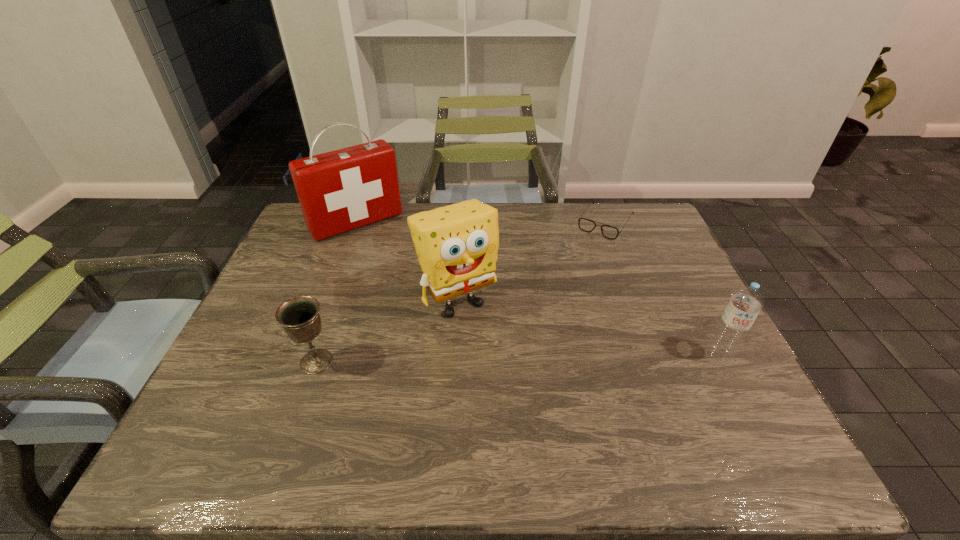
Where is `free space between the third object from left to right and the chalice`? The image size is (960, 540). free space between the third object from left to right and the chalice is located at coordinates (387, 330).

At what (x,y) coordinates should I click in order to perform the action: click on vacant area that lies between the tallest object and the rightmost object. Please return your answer as a coordinate pair (x, y). This screenshot has height=540, width=960. Looking at the image, I should click on (538, 289).

You are a GUI agent. You are given a task and a screenshot of the screen. Output one action in this format:
    pyautogui.click(x=<x>, y=<y>)
    Task: Click on the free space between the first-aid kit and the fourth tallest object
    Image resolution: width=960 pixels, height=540 pixels.
    Given the screenshot: What is the action you would take?
    pyautogui.click(x=337, y=292)

What are the coordinates of `empty space between the third tallest object and the shortest object` in the screenshot? It's located at (661, 289).

At what (x,y) coordinates should I click in order to perform the action: click on free space between the second tallest object and the sunglasses. Please return your answer as a coordinate pair (x, y). Looking at the image, I should click on (531, 261).

At what (x,y) coordinates should I click in order to perform the action: click on vacant area that lies between the third farthest object and the first-aid kit. Please return your answer as a coordinate pair (x, y). Image resolution: width=960 pixels, height=540 pixels. Looking at the image, I should click on (407, 261).

Locate an element on the screen. This screenshot has height=540, width=960. vacant space in between the third object from left to right and the second shortest object is located at coordinates (387, 330).

This screenshot has height=540, width=960. I want to click on free area in between the third shortest object and the fourth tallest object, so click(517, 359).

Locate which object is the closest to the first-aid kit. Please provide its 2D coordinates. Your answer should be formatted as a tuple, i.e. [(x, y)], where the tuple contains the x and y coordinates of a point satisfying the conditions above.

[(457, 245)]

This screenshot has height=540, width=960. I want to click on object that ranks as the third closest to the tallest object, so click(587, 225).